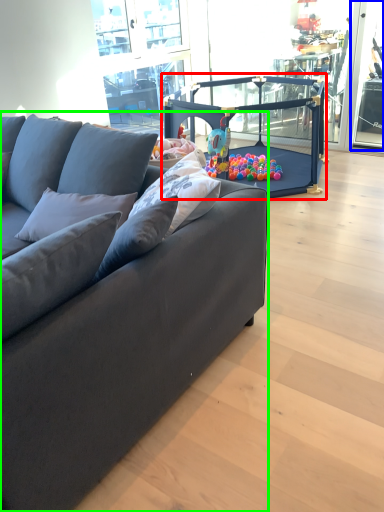
Question: Based on their relative distances, which object is nearer to baby carriage (highlighted by a red box)? Choose from window screen (highlighted by a blue box) and studio couch (highlighted by a green box).

Choices:
 (A) window screen
 (B) studio couch

Answer: (A)